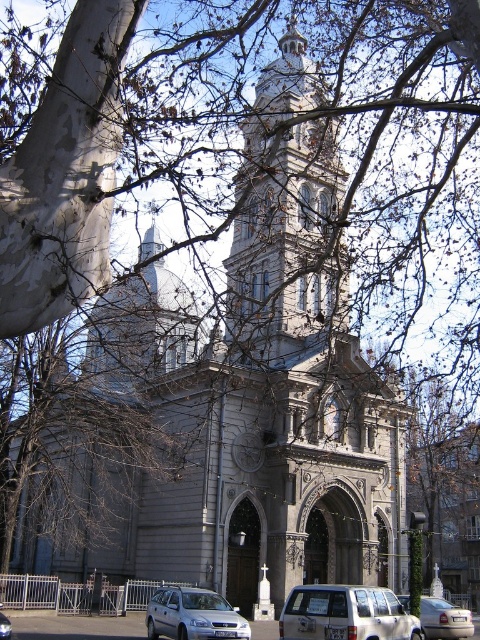
You are standing at the camera position and want to take a photo of the satin silver wagon at lower center. The camera has a maximum zoom range of 100 feet. Can you capture the wagon without moving closer?

The satin silver wagon at lower center and camera are 167.25 feet apart, which exceeds the camera maximum zoom range of 100 feet. Therefore, you cannot capture the wagon without moving closer.